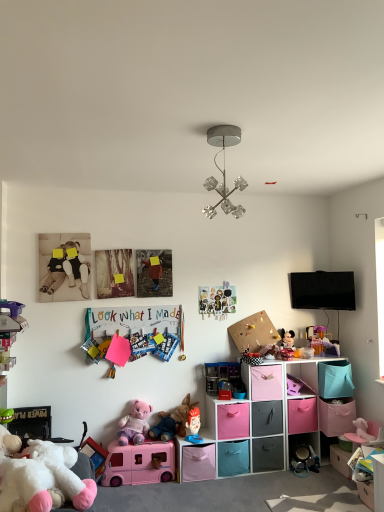
Find the location of `free spot in front of matte pink plastic van at lower center, which ranks as the 3th toy in front-to-back order`. free spot in front of matte pink plastic van at lower center, which ranks as the 3th toy in front-to-back order is located at coordinates (131, 493).